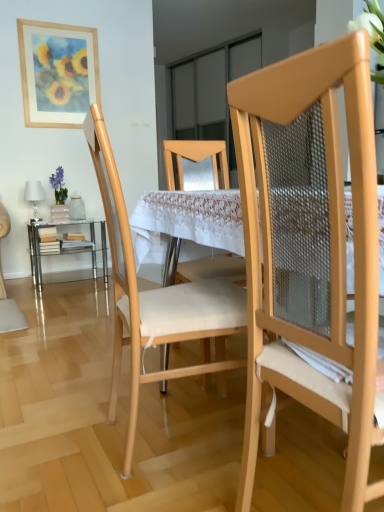
Describe the element at coordinates (188, 224) in the screenshot. This screenshot has width=384, height=512. I see `white lace tablecloth at center, which is counted as the first table, starting from the right` at that location.

At what (x,y) coordinates should I click in order to perform the action: click on matte wood chair at right, which appears as the first chair when viewed from the front. Please return your answer as a coordinate pair (x, y). Looking at the image, I should click on [x=310, y=246].

You are a GUI agent. You are given a task and a screenshot of the screen. Output one action in this format:
    pyautogui.click(x=<x>, y=<y>)
    Task: Click on the white lace tablecloth at center, which is the 1th table in front-to-back order
    The height and width of the screenshot is (512, 384).
    Given the screenshot: What is the action you would take?
    pyautogui.click(x=188, y=224)

Is the depth of clear glass table at lower left, acting as the 1th table starting from the left, greater than that of wooden framed artwork at upper left?

No, clear glass table at lower left, acting as the 1th table starting from the left, is in front of wooden framed artwork at upper left.

Considering the sizes of clear glass table at lower left, the 2th table positioned from the right, and wooden framed artwork at upper left in the image, is clear glass table at lower left, the 2th table positioned from the right, bigger or smaller than wooden framed artwork at upper left?

Considering their sizes, clear glass table at lower left, the 2th table positioned from the right, takes up more space than wooden framed artwork at upper left.

Can you confirm if wooden framed artwork at upper left is shorter than natural wood chair at center, placed as the 1th chair when sorted from back to front?

Yes.

From a real-world perspective, is wooden framed artwork at upper left over natural wood chair at center, marked as the second chair in a front-to-back arrangement?

Yes, from a real-world perspective, wooden framed artwork at upper left is over natural wood chair at center, marked as the second chair in a front-to-back arrangement

Measure the distance from wooden framed artwork at upper left to natural wood chair at center, marked as the second chair in a front-to-back arrangement.

wooden framed artwork at upper left is 2.33 meters from natural wood chair at center, marked as the second chair in a front-to-back arrangement.

Which of these two, natural wood chair at center, marked as the second chair in a front-to-back arrangement, or matte wood chair at right, the second chair when ordered from back to front, is thinner?

Thinner between the two is matte wood chair at right, the second chair when ordered from back to front.

From the picture: Is natural wood chair at center, marked as the second chair in a front-to-back arrangement, behind matte wood chair at right, the second chair when ordered from back to front?

Yes.

From a real-world perspective, is natural wood chair at center, placed as the 1th chair when sorted from back to front, located beneath matte wood chair at right, the second chair when ordered from back to front?

Yes, from a real-world perspective, natural wood chair at center, placed as the 1th chair when sorted from back to front, is beneath matte wood chair at right, the second chair when ordered from back to front.

Considering the relative sizes of white lace tablecloth at center, the second table when ordered from back to front, and wooden framed artwork at upper left in the image provided, is white lace tablecloth at center, the second table when ordered from back to front, thinner than wooden framed artwork at upper left?

Incorrect, the width of white lace tablecloth at center, the second table when ordered from back to front, is not less than that of wooden framed artwork at upper left.

Which of these two, white lace tablecloth at center, the second table when ordered from left to right, or wooden framed artwork at upper left, is bigger?

white lace tablecloth at center, the second table when ordered from left to right.

Find the location of a particular element. The width and height of the screenshot is (384, 512). picture frame above the white lace tablecloth at center, the second table when ordered from left to right (from a real-world perspective) is located at coordinates (58, 73).

Does point (209, 250) appear closer or farther from the camera than point (57, 106)?

Clearly, point (209, 250) is closer to the camera than point (57, 106).

Is natural wood chair at center, marked as the second chair in a front-to-back arrangement, shorter than white lace tablecloth at center, the second table when ordered from left to right?

No.

Can you tell me how much natural wood chair at center, placed as the 1th chair when sorted from back to front, and white lace tablecloth at center, which is the 1th table in front-to-back order, differ in facing direction?

103 degrees separate the facing orientations of natural wood chair at center, placed as the 1th chair when sorted from back to front, and white lace tablecloth at center, which is the 1th table in front-to-back order.

From a real-world perspective, which is physically below, natural wood chair at center, marked as the second chair in a front-to-back arrangement, or white lace tablecloth at center, the second table when ordered from left to right?

white lace tablecloth at center, the second table when ordered from left to right, is physically lower.

Visually, is natural wood chair at center, marked as the second chair in a front-to-back arrangement, positioned to the left or to the right of white lace tablecloth at center, the second table when ordered from back to front?

Based on their positions, natural wood chair at center, marked as the second chair in a front-to-back arrangement, is located to the left of white lace tablecloth at center, the second table when ordered from back to front.

Who is taller, matte wood chair at right, the second chair when ordered from back to front, or white lace tablecloth at center, which is counted as the first table, starting from the right?

matte wood chair at right, the second chair when ordered from back to front, is taller.

Is point (269, 183) farther from viewer compared to point (199, 196)?

No, (269, 183) is in front of (199, 196).

Is matte wood chair at right, the second chair when ordered from back to front, closer to the viewer compared to white lace tablecloth at center, which is counted as the first table, starting from the right?

Yes, matte wood chair at right, the second chair when ordered from back to front, is closer to the viewer.

Is matte wood chair at right, which appears as the first chair when viewed from the front, outside of white lace tablecloth at center, which is the 1th table in front-to-back order?

No.

You are a GUI agent. You are given a task and a screenshot of the screen. Output one action in this format:
    pyautogui.click(x=<x>, y=<y>)
    Task: Click on the chair that is the 1st object directly below the wooden framed artwork at upper left (from a real-world perspective)
    The image size is (384, 512).
    Given the screenshot: What is the action you would take?
    pyautogui.click(x=310, y=246)

Is matte wood chair at right, the second chair when ordered from back to front, bigger than wooden framed artwork at upper left?

Yes, matte wood chair at right, the second chair when ordered from back to front, is bigger than wooden framed artwork at upper left.

Is matte wood chair at right, which appears as the first chair when viewed from the front, oriented towards wooden framed artwork at upper left?

No, matte wood chair at right, which appears as the first chair when viewed from the front, is not aimed at wooden framed artwork at upper left.

Locate an element on the screen. table that is the 1st object located in front of the wooden framed artwork at upper left is located at coordinates (65, 248).

You are a GUI agent. You are given a task and a screenshot of the screen. Output one action in this format:
    pyautogui.click(x=<x>, y=<y>)
    Task: Click on the picture frame located behind the natural wood chair at center, placed as the 1th chair when sorted from back to front
    This screenshot has width=384, height=512.
    Given the screenshot: What is the action you would take?
    pyautogui.click(x=58, y=73)

When comparing their distances from matte wood chair at right, which appears as the first chair when viewed from the front, does white lace tablecloth at center, which is counted as the first table, starting from the right, or wooden framed artwork at upper left seem closer?

white lace tablecloth at center, which is counted as the first table, starting from the right.

When comparing their distances from clear glass table at lower left, acting as the 1th table starting from the left, does wooden framed artwork at upper left or white lace tablecloth at center, the second table when ordered from back to front, seem further?

Among the two, white lace tablecloth at center, the second table when ordered from back to front, is located further to clear glass table at lower left, acting as the 1th table starting from the left.

When comparing their distances from clear glass table at lower left, the 2th table positioned from the right, does natural wood chair at center, placed as the 1th chair when sorted from back to front, or wooden framed artwork at upper left seem further?

natural wood chair at center, placed as the 1th chair when sorted from back to front.

Estimate the real-world distances between objects in this image. Which object is further from matte wood chair at right, which appears as the first chair when viewed from the front, clear glass table at lower left, which is the 1th table from back to front, or wooden framed artwork at upper left?

Among the two, wooden framed artwork at upper left is located further to matte wood chair at right, which appears as the first chair when viewed from the front.

From the image, which object appears to be farther from clear glass table at lower left, acting as the second table starting from the front, white lace tablecloth at center, which is counted as the first table, starting from the right, or wooden framed artwork at upper left?

white lace tablecloth at center, which is counted as the first table, starting from the right.

Looking at the image, which one is located closer to matte wood chair at right, the second chair when ordered from back to front, wooden framed artwork at upper left or white lace tablecloth at center, which is counted as the first table, starting from the right?

white lace tablecloth at center, which is counted as the first table, starting from the right, lies closer to matte wood chair at right, the second chair when ordered from back to front, than the other object.

Looking at this image, based on their spatial positions, is natural wood chair at center, marked as the second chair in a front-to-back arrangement, or matte wood chair at right, the second chair when ordered from back to front, further from white lace tablecloth at center, which is counted as the first table, starting from the right?

Among the two, matte wood chair at right, the second chair when ordered from back to front, is located further to white lace tablecloth at center, which is counted as the first table, starting from the right.

Considering their positions, is natural wood chair at center, marked as the second chair in a front-to-back arrangement, positioned closer to wooden framed artwork at upper left than white lace tablecloth at center, the second table when ordered from left to right?

Among the two, natural wood chair at center, marked as the second chair in a front-to-back arrangement, is located nearer to wooden framed artwork at upper left.

In order to click on chair between matte wood chair at right, which appears as the first chair when viewed from the front, and clear glass table at lower left, the 2th table positioned from the right, along the z-axis in this screenshot , I will do `click(155, 296)`.

Find the location of `chair between white lace tablecloth at center, the second table when ordered from back to front, and clear glass table at lower left, acting as the 1th table starting from the left, in the front-back direction`. chair between white lace tablecloth at center, the second table when ordered from back to front, and clear glass table at lower left, acting as the 1th table starting from the left, in the front-back direction is located at coordinates (155, 296).

Identify the location of chair positioned between white lace tablecloth at center, the second table when ordered from left to right, and wooden framed artwork at upper left from near to far. (155, 296).

Locate an element on the screen. This screenshot has width=384, height=512. chair located between matte wood chair at right, which appears as the first chair when viewed from the front, and wooden framed artwork at upper left in the depth direction is located at coordinates (155, 296).